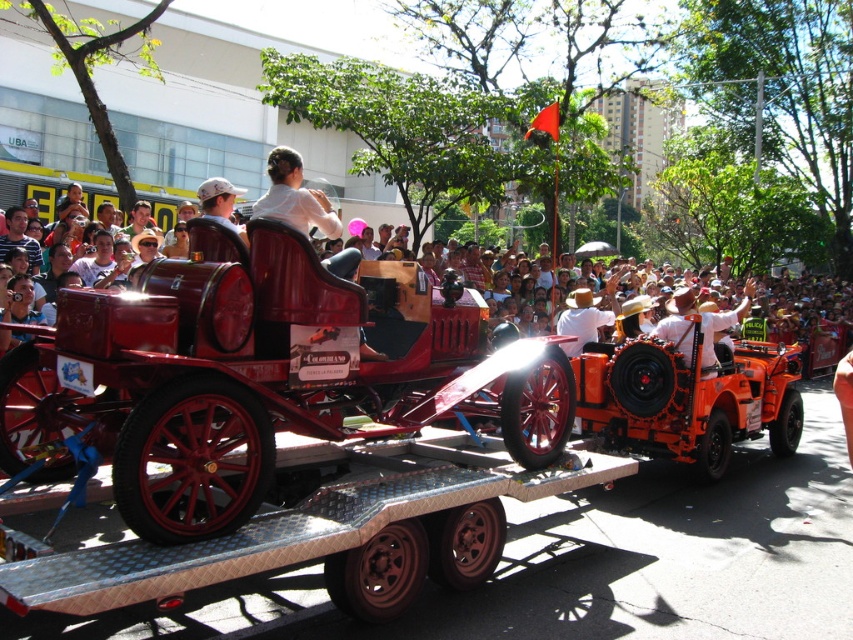
Which of these two, orange fabric shirt at center or white straw hat at center, stands taller?

With more height is white straw hat at center.

Which of these two, orange fabric shirt at center or white straw hat at center, stands shorter?

Standing shorter between the two is orange fabric shirt at center.

The image size is (853, 640). Describe the element at coordinates (700, 324) in the screenshot. I see `orange fabric shirt at center` at that location.

Locate an element on the screen. The width and height of the screenshot is (853, 640). orange fabric shirt at center is located at coordinates (700, 324).

Does matte white crowd at center have a lesser width compared to white matte shirt at upper center?

No.

Is matte white crowd at center taller than white matte shirt at upper center?

Correct, matte white crowd at center is much taller as white matte shirt at upper center.

Does point (776, 301) lie in front of point (280, 202)?

No, it is not.

What are the coordinates of `matte white crowd at center` in the screenshot? It's located at (804, 317).

Between white matte shirt at upper center and orange fabric shirt at center, which one has more height?

white matte shirt at upper center

Which is more to the left, white matte shirt at upper center or orange fabric shirt at center?

white matte shirt at upper center is more to the left.

Who is more forward, (289, 208) or (654, 332)?

Point (289, 208) is more forward.

Find the location of a particular element. Image resolution: width=853 pixels, height=640 pixels. white matte shirt at upper center is located at coordinates (294, 196).